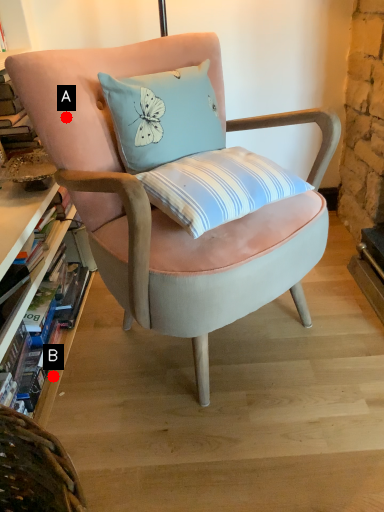
Question: Two points are circled on the image, labeled by A and B beside each circle. Which point is closer to the camera?

Choices:
 (A) A is closer
 (B) B is closer

Answer: (A)